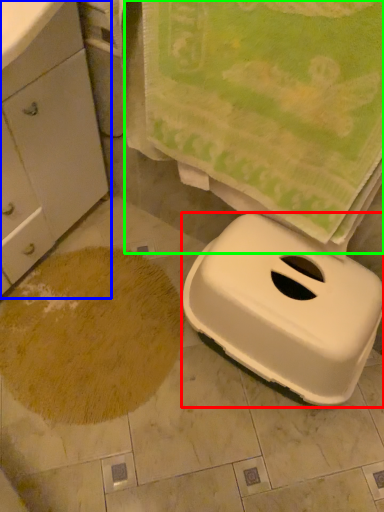
Question: Which object is the closest to the appliance (highlighted by a red box)? Choose among these: cabinetry (highlighted by a blue box) or beach towel (highlighted by a green box).

Choices:
 (A) cabinetry
 (B) beach towel

Answer: (B)